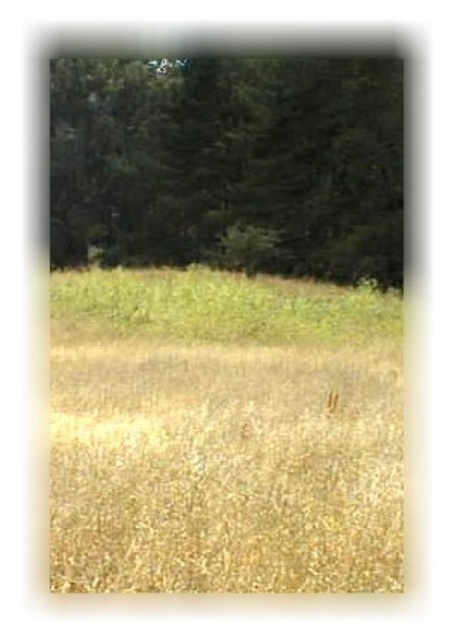
Question: Can you confirm if dry grass at center is wider than green matte tree at upper center?

Choices:
 (A) no
 (B) yes

Answer: (A)

Question: From the image, what is the correct spatial relationship of dry grass at center in relation to green matte tree at upper center?

Choices:
 (A) below
 (B) above

Answer: (A)

Question: Can you confirm if dry grass at center is bigger than green matte tree at upper center?

Choices:
 (A) no
 (B) yes

Answer: (A)

Question: Which object appears closest to the camera in this image?

Choices:
 (A) green matte tree at upper center
 (B) dry grass at center

Answer: (B)